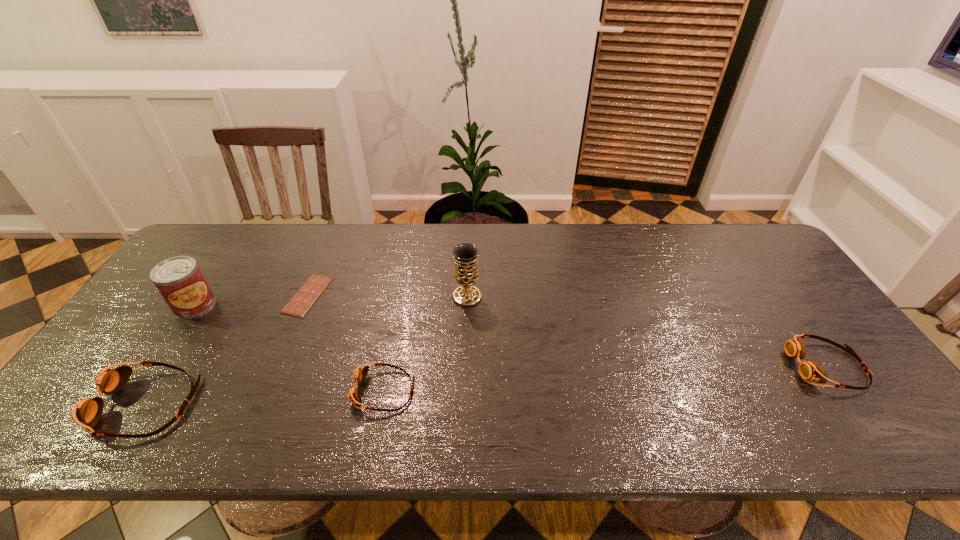
If we want them evenly spaced by inserting an extra goggles among them, please locate a free spot for this new goggles. Please provide its 2D coordinates. Your answer should be formatted as a tuple, i.e. [(x, y)], where the tuple contains the x and y coordinates of a point satisfying the conditions above.

[(611, 378)]